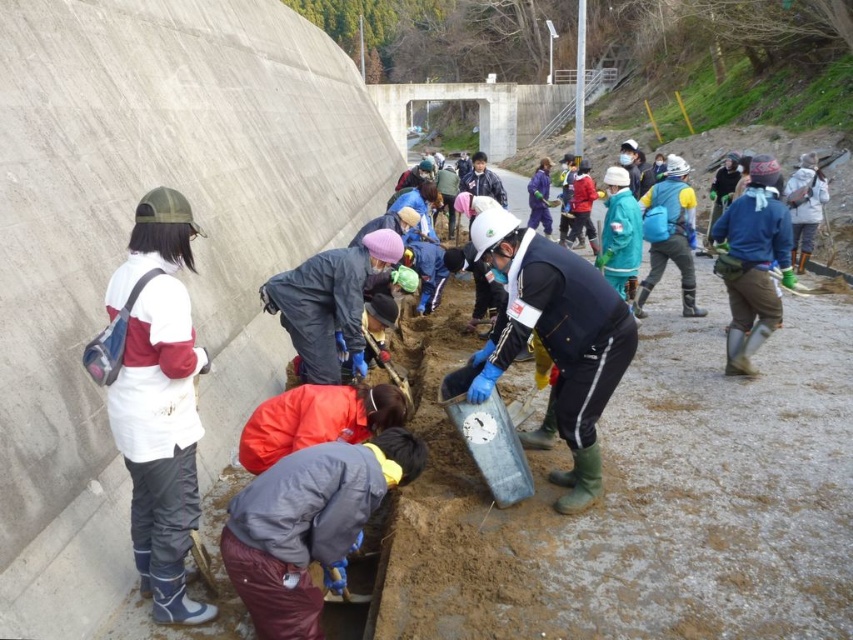
Who is lower down, smooth concrete at left or white hard hat at center?

white hard hat at center

Between point (291, 156) and point (614, 384), which one is positioned in front?

Positioned in front is point (614, 384).

Locate an element on the screen. This screenshot has width=853, height=640. smooth concrete at left is located at coordinates (126, 237).

Is smooth concrete at left thinner than white matte jacket at left?

No, smooth concrete at left is not thinner than white matte jacket at left.

Can you confirm if smooth concrete at left is bigger than white matte jacket at left?

Yes.

Between point (12, 472) and point (119, 394), which one is positioned in front?

Point (12, 472)

What are the coordinates of `smooth concrete at left` in the screenshot? It's located at (126, 237).

Is white matte jacket at left above white hard hat at center?

No, white matte jacket at left is not above white hard hat at center.

Is point (144, 337) farther from viewer compared to point (560, 369)?

That is False.

The image size is (853, 640). Find the location of `white matte jacket at left`. white matte jacket at left is located at coordinates (160, 401).

What are the coordinates of `white matte jacket at left` in the screenshot? It's located at (160, 401).